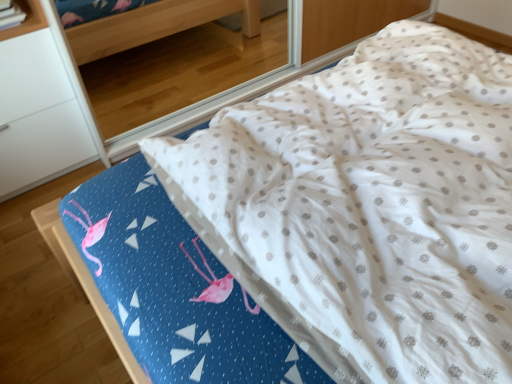
I want to click on white matte cabinet at left, so point(42,106).

What do you see at coordinates (42, 106) in the screenshot? I see `white matte cabinet at left` at bounding box center [42, 106].

In order to face white matte shelf at upper left, should I rotate leftwards or rightwards?

To align with it, rotate left about 31.019°.

The image size is (512, 384). What do you see at coordinates (27, 20) in the screenshot?
I see `white matte shelf at upper left` at bounding box center [27, 20].

Locate an element on the screen. white matte shelf at upper left is located at coordinates (27, 20).

This screenshot has height=384, width=512. I want to click on white matte cabinet at left, so click(42, 106).

Is white matte cabinet at left to the right of white matte shelf at upper left from the viewer's perspective?

No, white matte cabinet at left is not to the right of white matte shelf at upper left.

Based on the photo, which object is closer to the camera taking this photo, white matte cabinet at left or white matte shelf at upper left?

white matte cabinet at left is in front.

Between point (32, 32) and point (25, 2), which one is positioned in front?

The point (32, 32) is closer to the camera.

From the image's perspective, is white matte cabinet at left positioned above or below white matte shelf at upper left?

white matte cabinet at left is situated lower than white matte shelf at upper left in the image.

From a real-world perspective, is white matte cabinet at left on white matte shelf at upper left?

No, from a real-world perspective, white matte cabinet at left is not on top of white matte shelf at upper left.

Which object is thinner, white matte cabinet at left or white matte shelf at upper left?

With smaller width is white matte shelf at upper left.

Can you confirm if white matte cabinet at left is taller than white matte shelf at upper left?

Indeed, white matte cabinet at left has a greater height compared to white matte shelf at upper left.

Which of these two, white matte cabinet at left or white matte shelf at upper left, is smaller?

white matte shelf at upper left.

Is white matte cabinet at left situated inside white matte shelf at upper left or outside?

white matte cabinet at left is outside white matte shelf at upper left.

Are white matte cabinet at left and white matte shelf at upper left located far from each other?

white matte cabinet at left is near white matte shelf at upper left, not far away.

Is white matte cabinet at left oriented away from white matte shelf at upper left?

No, white matte cabinet at left is not facing away from white matte shelf at upper left.

At what (x,y) coordinates should I click in order to perform the action: click on furniture that is below the white matte shelf at upper left (from the image's perspective). Please return your answer as a coordinate pair (x, y). Image resolution: width=512 pixels, height=384 pixels. Looking at the image, I should click on (42, 106).

Is white matte shelf at upper left to the right of white matte cabinet at left from the viewer's perspective?

Yes, white matte shelf at upper left is to the right of white matte cabinet at left.

Between white matte shelf at upper left and white matte cabinet at left, which one is positioned behind?

white matte shelf at upper left.

Is point (32, 5) behind point (23, 172)?

That is False.

From the image's perspective, relative to white matte cabinet at left, is white matte shelf at upper left above or below?

white matte shelf at upper left is above white matte cabinet at left.

From a real-world perspective, is white matte shelf at upper left on white matte cabinet at left?

Correct, in the physical world, white matte shelf at upper left is higher than white matte cabinet at left.

Considering the relative sizes of white matte shelf at upper left and white matte cabinet at left in the image provided, is white matte shelf at upper left thinner than white matte cabinet at left?

Yes, white matte shelf at upper left is thinner than white matte cabinet at left.

Between white matte shelf at upper left and white matte cabinet at left, which one has more height?

white matte cabinet at left is taller.

Who is bigger, white matte shelf at upper left or white matte cabinet at left?

white matte cabinet at left is bigger.

Is white matte cabinet at left completely or partially inside white matte shelf at upper left?

Answer: No.

Is white matte shelf at upper left touching white matte cabinet at left?

white matte shelf at upper left is not next to white matte cabinet at left, and they're not touching.

Is white matte cabinet at left at the back of white matte shelf at upper left?

No.

Can you tell me how much white matte shelf at upper left and white matte cabinet at left differ in facing direction?

0.884 degrees.

In order to click on shelf above the white matte cabinet at left (from a real-world perspective) in this screenshot , I will do `click(27, 20)`.

At what (x,y) coordinates should I click in order to perform the action: click on furniture below the white matte shelf at upper left (from the image's perspective). Please return your answer as a coordinate pair (x, y). The height and width of the screenshot is (384, 512). Looking at the image, I should click on (42, 106).

At what (x,y) coordinates should I click in order to perform the action: click on shelf to the right of white matte cabinet at left. Please return your answer as a coordinate pair (x, y). The width and height of the screenshot is (512, 384). Looking at the image, I should click on (27, 20).